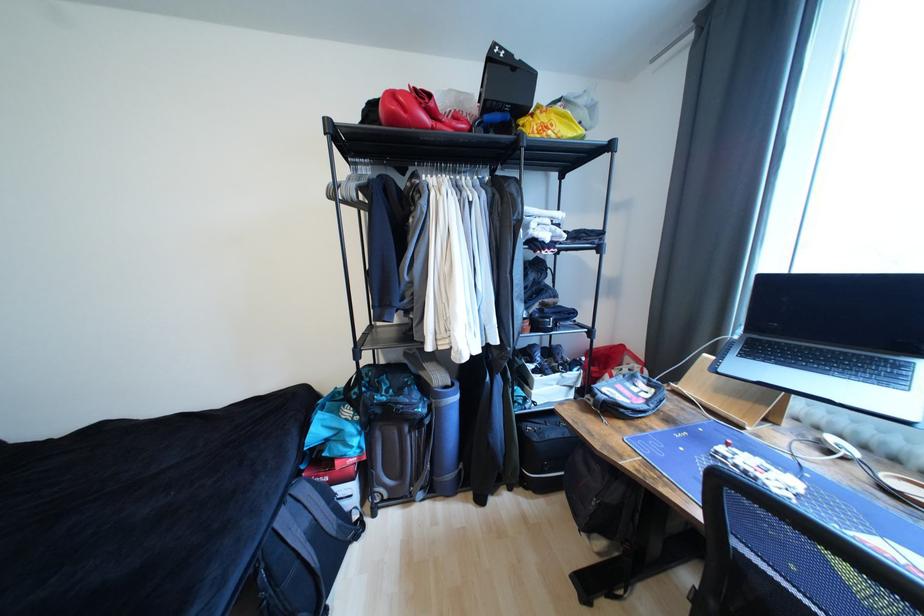
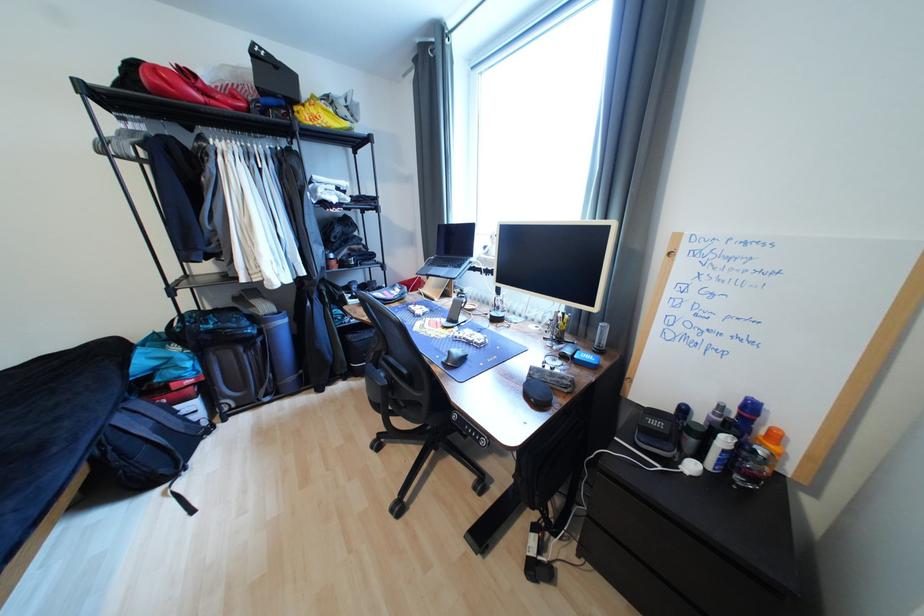
Question: The first image is from the beginning of the video and the second image is from the end. How did the camera likely rotate when shooting the video?

Choices:
 (A) Left
 (B) Right
 (C) Up
 (D) Down

Answer: (B)